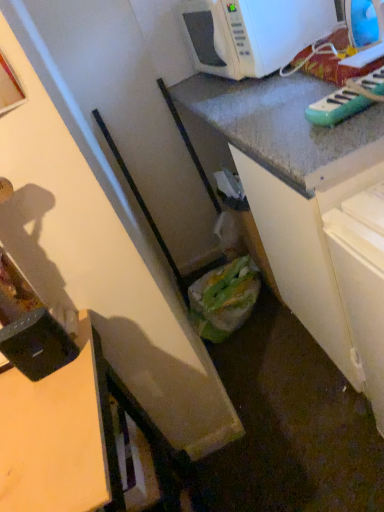
You are a GUI agent. You are given a task and a screenshot of the screen. Output one action in this format:
    pyautogui.click(x=<x>, y=<y>)
    Task: Click on the free region on the left part of black plastic container at lower left, acting as the 1th appliance starting from the left
    
    Given the screenshot: What is the action you would take?
    pyautogui.click(x=13, y=389)